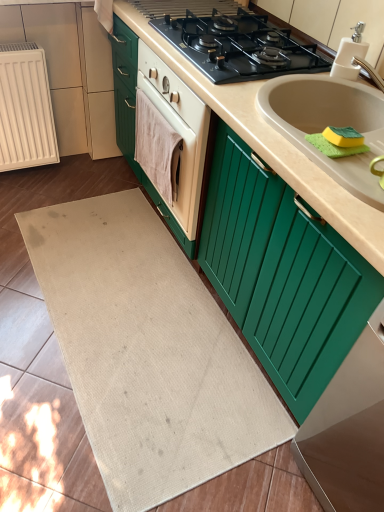
Locate an element on the screen. Image resolution: width=384 pixels, height=512 pixels. free spot below green matte cabinet at lower right (from a real-world perspective) is located at coordinates (349, 460).